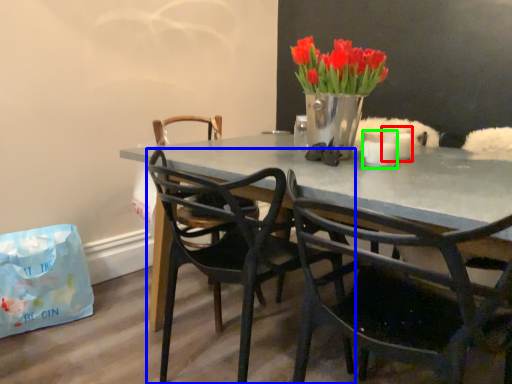
Question: Based on their relative distances, which object is nearer to candle (highlighted by a red box)? Choose from chair (highlighted by a blue box) and candle (highlighted by a green box).

Choices:
 (A) chair
 (B) candle

Answer: (B)